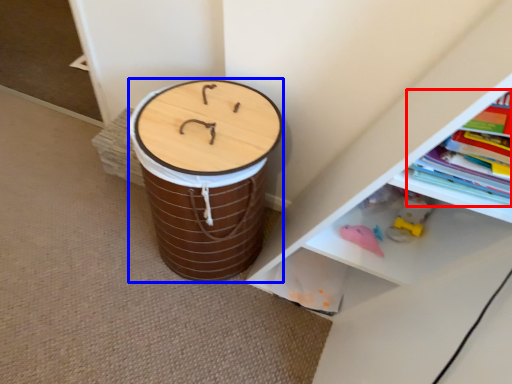
Question: Among these objects, which one is nearest to the camera, book (highlighted by a red box) or drum (highlighted by a blue box)?

Choices:
 (A) book
 (B) drum

Answer: (A)